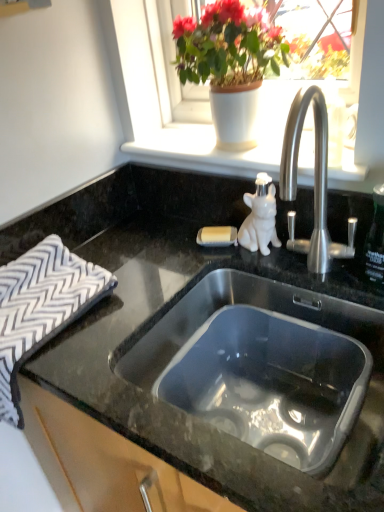
Locate an element on the screen. Image resolution: width=384 pixels, height=512 pixels. free space above black granite countertop at center (from a real-world perspective) is located at coordinates (170, 275).